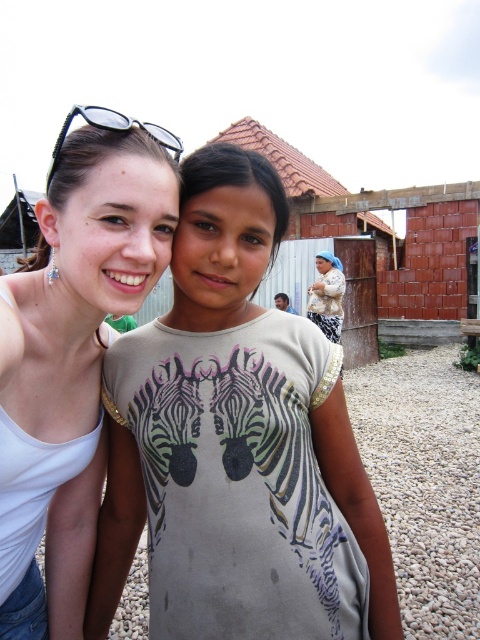
Is white matte tank top at upper left bigger than beige textured shawl at center?

No.

Is point (157, 166) closer to viewer compared to point (339, 280)?

Yes, point (157, 166) is in front of point (339, 280).

Does point (15, 292) come closer to viewer compared to point (326, 328)?

Yes, point (15, 292) is closer to viewer.

You are a GUI agent. You are given a task and a screenshot of the screen. Output one action in this format:
    pyautogui.click(x=<x>, y=<y>)
    Task: Click on the white matte tank top at upper left
    The height and width of the screenshot is (640, 480).
    Given the screenshot: What is the action you would take?
    pyautogui.click(x=83, y=321)

Is beige textured shawl at center closer to the viewer compared to sunglasses at upper left?

No, beige textured shawl at center is further to the viewer.

Can you confirm if beige textured shawl at center is bigger than sunglasses at upper left?

Indeed, beige textured shawl at center has a larger size compared to sunglasses at upper left.

Is point (323, 252) closer to viewer compared to point (179, 145)?

No, it is not.

I want to click on beige textured shawl at center, so click(x=326, y=296).

In the scene shown: Can you confirm if light beige fabric dress at center is wider than beige textured shawl at center?

Yes.

Is light beige fabric dress at center bigger than beige textured shawl at center?

Incorrect, light beige fabric dress at center is not larger than beige textured shawl at center.

Does point (210, 524) lie behind point (313, 323)?

No, (210, 524) is in front of (313, 323).

Find the location of `light beige fabric dress at center`. light beige fabric dress at center is located at coordinates click(x=235, y=440).